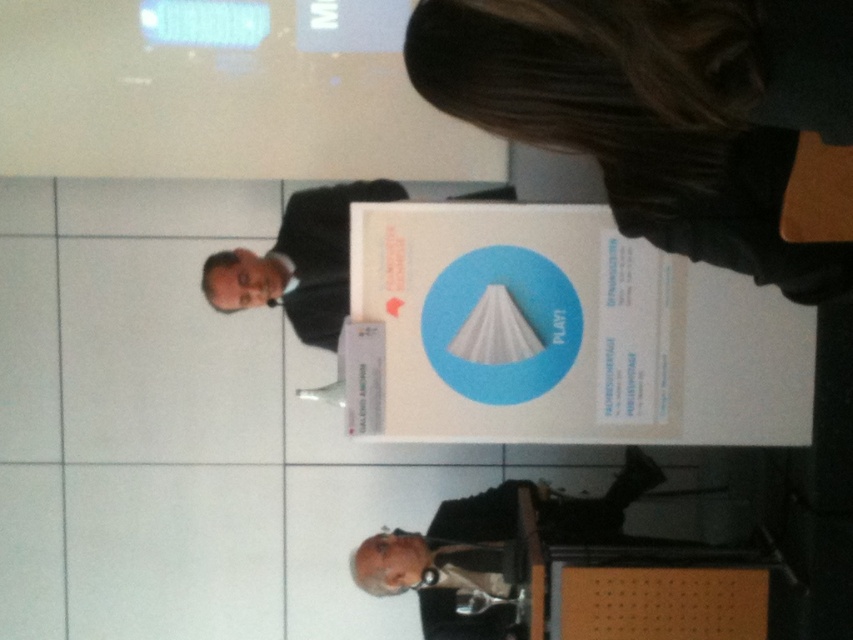
You are an event planner assessing the stage setup for proper visibility. Considering the black fabric hair at upper center and the black suit at center, which object takes up more visual space in the image?

The black suit at center occupies more visual space than the black fabric hair at upper center, as stated in the description.

You are attending a formal event and notice two people on stage. One has black fabric hair at upper center and the other is wearing a black suit at center. Which one is positioned closer to the front of the stage?

The black fabric hair at upper center is positioned closer to the front of the stage because it is in front of the black suit at center.

You are attending a formal event and notice two individuals on stage. One has black fabric hair at upper center and the other is wearing a black suit at center. Based on their positions, which one is positioned higher in the image?

The black fabric hair at upper center is positioned higher in the image than the black suit at center.